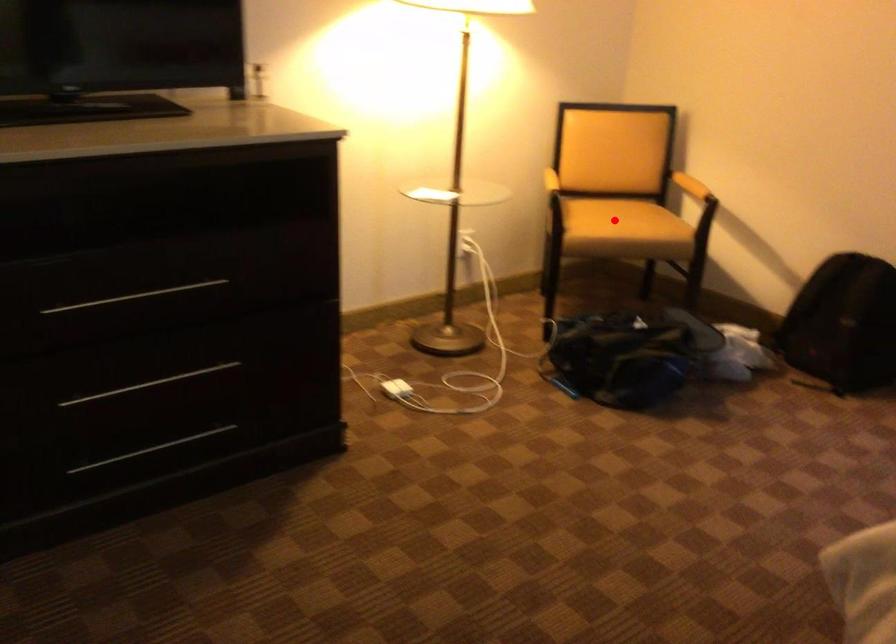
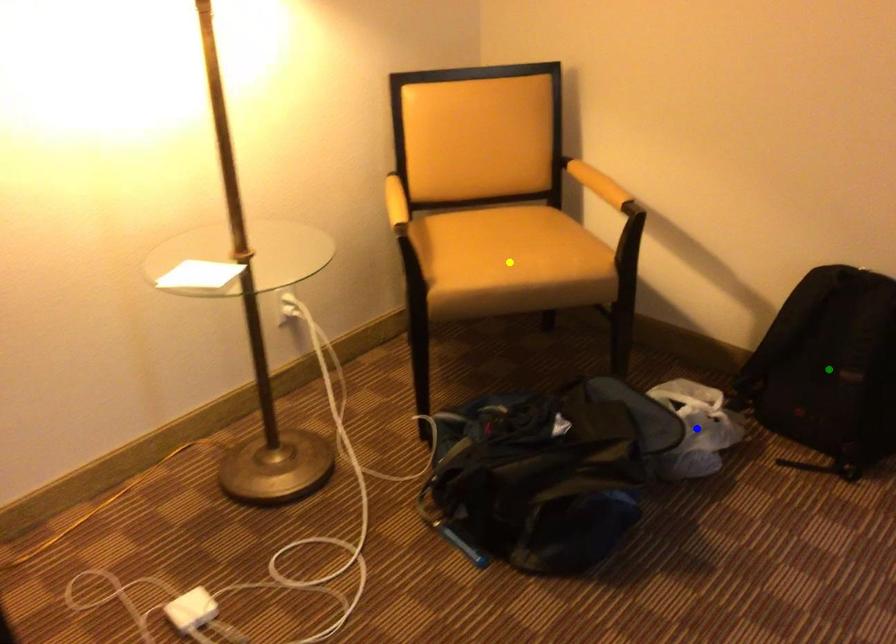
Question: I am providing you with two images of the same scene from different viewpoints. A red point is marked on the first image. You are given multiple points on the second image. Can you choose the point in image 2 that corresponds to the point in image 1?

Choices:
 (A) green point
 (B) yellow point
 (C) blue point

Answer: (B)